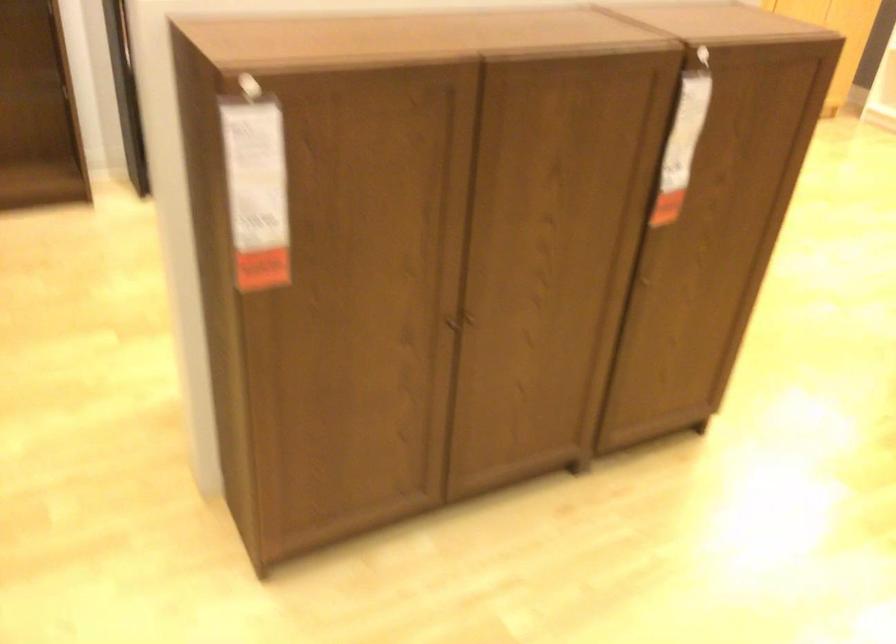
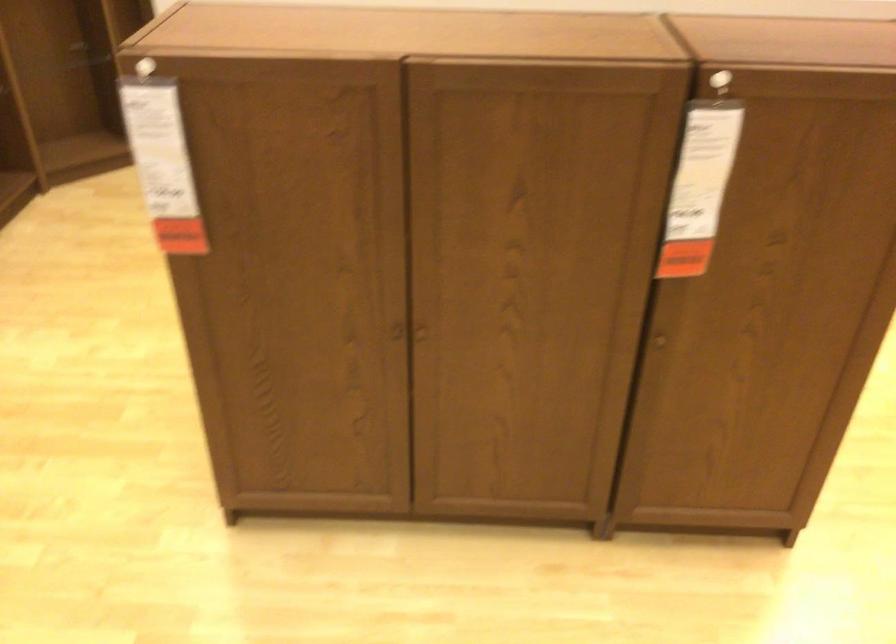
Where in the second image is the point corresponding to [684,128] from the first image?

(702, 169)